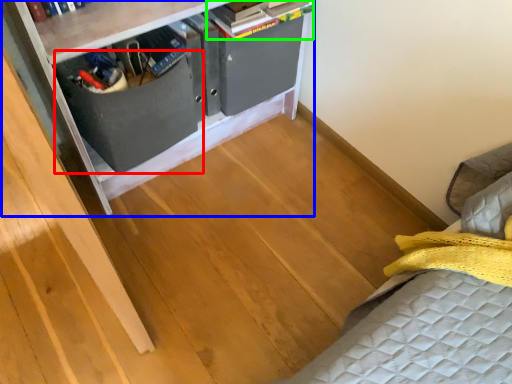
Question: Considering the real-world distances, which object is closest to drawer (highlighted by a red box)? furniture (highlighted by a blue box) or book (highlighted by a green box).

Choices:
 (A) furniture
 (B) book

Answer: (A)